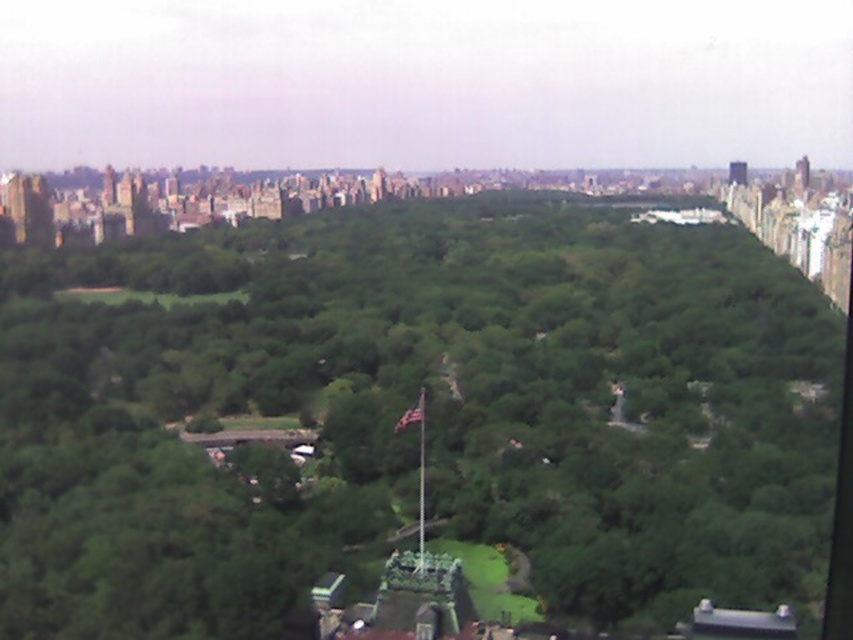
You are standing at the flagpole in the midleground of Central Park. You see a point at coordinate [427,413]. What is located at that point?

The point at coordinate [427,413] is where the green leafy trees at center are located.

You are a park visitor standing at the base of the dark gray stone tower at upper right. You want to take a photo of the green leafy trees at center. Which direction should you face to ensure the trees are in your camera frame?

The green leafy trees at center are located below the dark gray stone tower at upper right, so you should face downward to capture them in your photo.